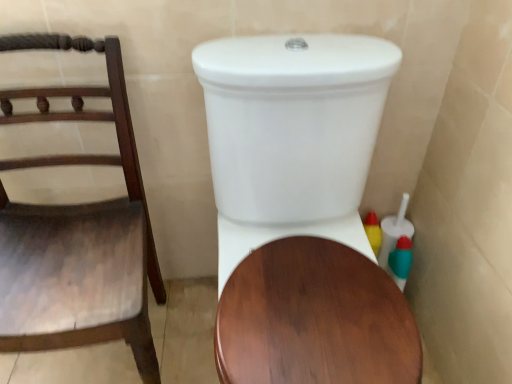
Question: From the image's perspective, is wooden chair at left located above or below white glossy toilet at center?

Choices:
 (A) above
 (B) below

Answer: (A)

Question: Is wooden chair at left wider or thinner than white glossy toilet at center?

Choices:
 (A) thin
 (B) wide

Answer: (A)

Question: Does point (9, 322) appear closer or farther from the camera than point (275, 286)?

Choices:
 (A) closer
 (B) farther

Answer: (A)

Question: Is white glossy toilet at center situated inside wooden chair at left or outside?

Choices:
 (A) outside
 (B) inside

Answer: (A)

Question: From their relative heights in the image, would you say white glossy toilet at center is taller or shorter than wooden chair at left?

Choices:
 (A) tall
 (B) short

Answer: (A)

Question: In terms of size, does white glossy toilet at center appear bigger or smaller than wooden chair at left?

Choices:
 (A) small
 (B) big

Answer: (B)

Question: Is white glossy toilet at center wider or thinner than wooden chair at left?

Choices:
 (A) thin
 (B) wide

Answer: (B)